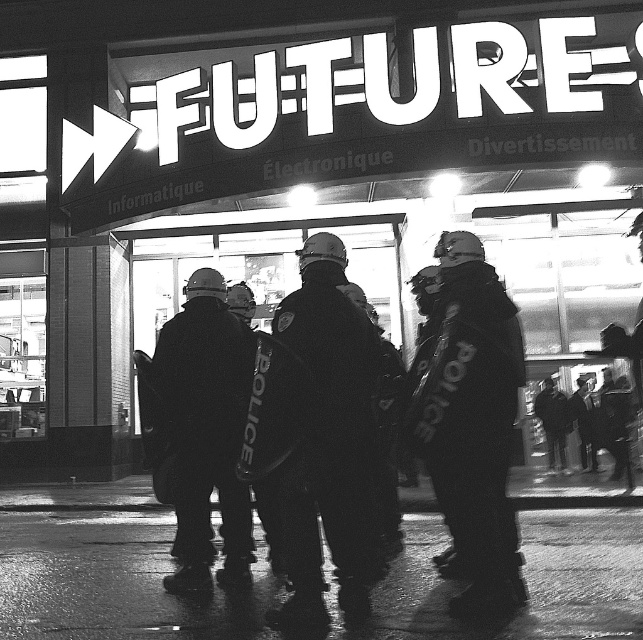
Consider the image. Is reflective black police uniform at center wider than dark matte police uniform at center?

Indeed, reflective black police uniform at center has a greater width compared to dark matte police uniform at center.

Who is positioned more to the left, reflective black police uniform at center or dark matte police uniform at center?

dark matte police uniform at center is more to the left.

This screenshot has width=643, height=640. Identify the location of reflective black police uniform at center. (473, 422).

Does dark matte police uniform at center appear on the left side of hard hat helmet at center?

Incorrect, dark matte police uniform at center is not on the left side of hard hat helmet at center.

Who is more distant from viewer, (345, 515) or (181, 593)?

The point (181, 593) is more distant.

Between point (365, 358) and point (210, 476), which one is positioned in front?

Point (365, 358) is more forward.

Where is `dark matte police uniform at center`? dark matte police uniform at center is located at coordinates (329, 440).

Does point (480, 262) come closer to viewer compared to point (188, 515)?

That is True.

Where is `reflective black police uniform at center`? This screenshot has width=643, height=640. reflective black police uniform at center is located at coordinates (473, 422).

Does point (451, 508) come farther from viewer compared to point (215, 577)?

No, it is not.

The image size is (643, 640). Find the location of `reflective black police uniform at center`. reflective black police uniform at center is located at coordinates (473, 422).